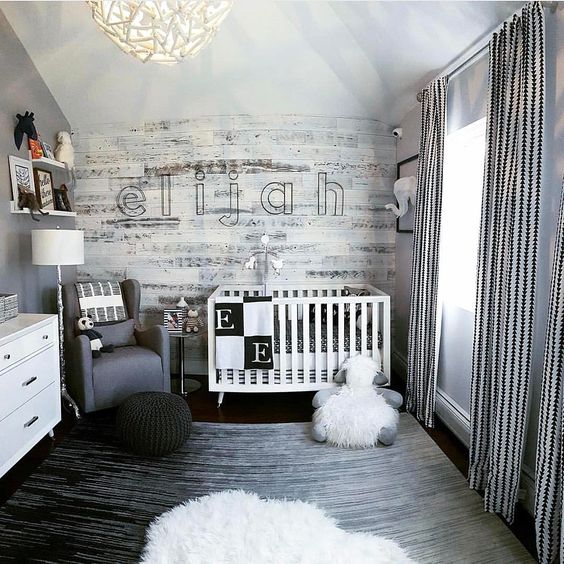
I want to click on drawer, so click(x=30, y=374), click(x=49, y=406), click(x=30, y=356), click(x=30, y=328).